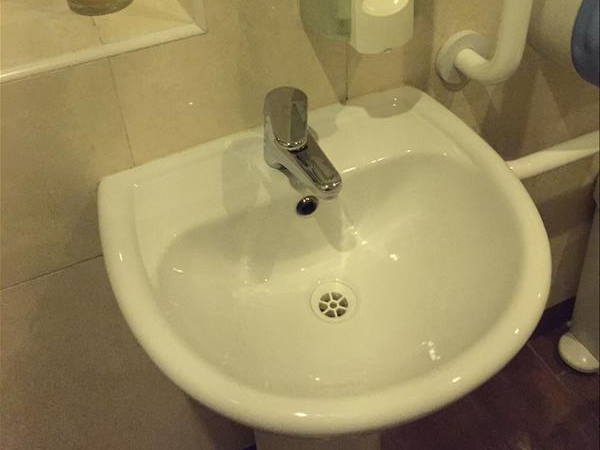
The width and height of the screenshot is (600, 450). Find the location of `faucet`. faucet is located at coordinates (303, 165).